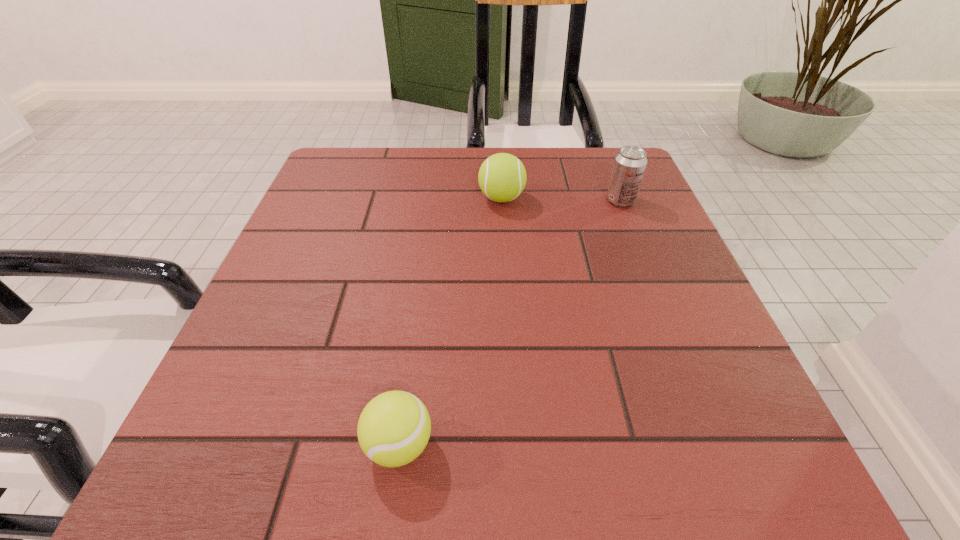
You are a GUI agent. You are given a task and a screenshot of the screen. Output one action in this format:
    pyautogui.click(x=<x>, y=<y>)
    Task: Click on the vacant area that lies between the beer can and the second object from left to right
    Image resolution: width=960 pixels, height=540 pixels.
    Given the screenshot: What is the action you would take?
    pyautogui.click(x=562, y=199)

Locate an element on the screen. The image size is (960, 540). object that is the second closest to the right tennis ball is located at coordinates (394, 427).

Locate which object is the closest to the rightmost object. Please provide its 2D coordinates. Your answer should be formatted as a tuple, i.e. [(x, y)], where the tuple contains the x and y coordinates of a point satisfying the conditions above.

[(502, 177)]

Identify the location of free spot that satisfies the following two spatial constraints: 1. on the back side of the shorter tennis ball; 2. on the right side of the beer can. (432, 201).

Where is `vacant space that satisfies the following two spatial constraints: 1. on the front side of the rightmost object; 2. on the left side of the farther tennis ball`? This screenshot has width=960, height=540. vacant space that satisfies the following two spatial constraints: 1. on the front side of the rightmost object; 2. on the left side of the farther tennis ball is located at coordinates (502, 201).